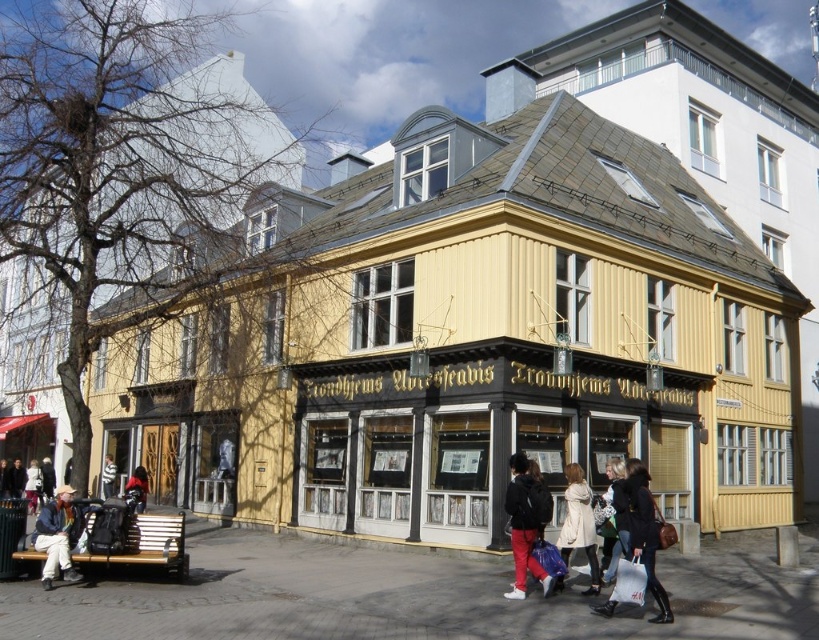
Question: Which object appears closest to the camera in this image?

Choices:
 (A) black wood/blackboard at center
 (B) white matte coat at center

Answer: (B)

Question: Is black leather jacket at lower center closer to the viewer compared to denim jacket at lower left?

Choices:
 (A) yes
 (B) no

Answer: (A)

Question: Can you confirm if yellow wood building at center is smaller than matte black jacket at lower right?

Choices:
 (A) yes
 (B) no

Answer: (B)

Question: Which is nearer to the yellow wood building at center?

Choices:
 (A) smooth concrete pavement at lower center
 (B) dark blue jacket at lower left
 (C) striped sweater at center
 (D) white matte coat at center

Answer: (A)

Question: Is yellow wood building at center smaller than dark blue jacket at lower left?

Choices:
 (A) no
 (B) yes

Answer: (A)

Question: Which object is closer to the camera taking this photo?

Choices:
 (A) yellow wood building at center
 (B) matte black jacket at lower right
 (C) dark brown leather jacket at lower left

Answer: (B)